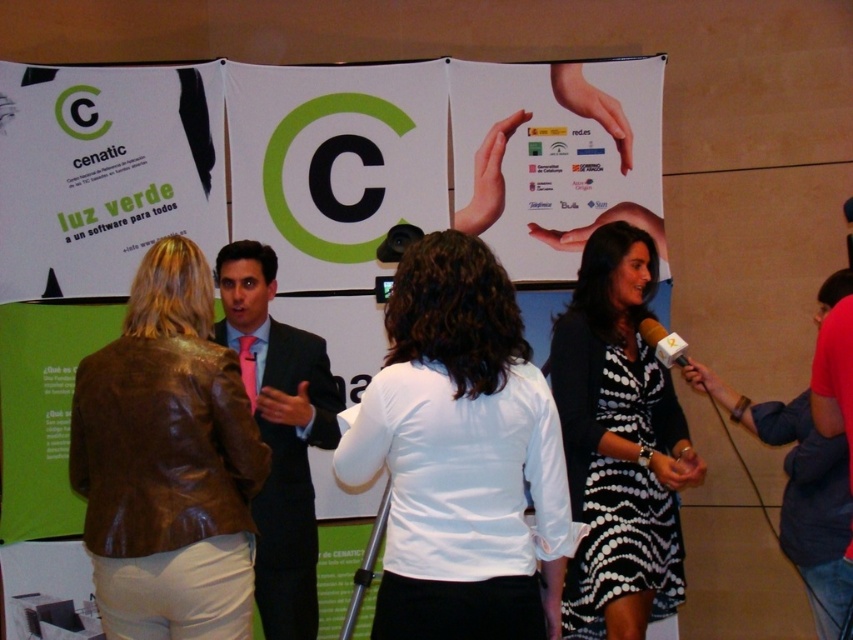
You are a photographer at this event. You want to take a photo that includes both the black dotted dress at right and the pink silk tie at center. The camera you are using has a minimum focus distance of 1 meter. Will both subjects be in focus if you position the camera to capture both?

The distance between the black dotted dress at right and the pink silk tie at center is 1.01 meters. Since the camera requires a minimum focus distance of 1 meter, the subjects are just beyond the required distance, so they should both be in focus.

You are at the event and want to approach the person wearing the red shirt at lower right. Which direction should you move relative to the black dotted dress at right?

You should move behind the black dotted dress at right to reach the red shirt at lower right because the black dotted dress at right is closer to you than the red shirt at lower right.

You are organizing a photo shoot and need to place two models wearing the black dotted dress at right and the red shirt at lower right. Given their sizes, which model should stand closer to the camera to maintain a balanced composition?

The black dotted dress at right is narrower than the red shirt at lower right. To maintain a balanced composition, the model wearing the black dotted dress at right should stand closer to the camera so that their smaller size appears proportionally larger in the frame.